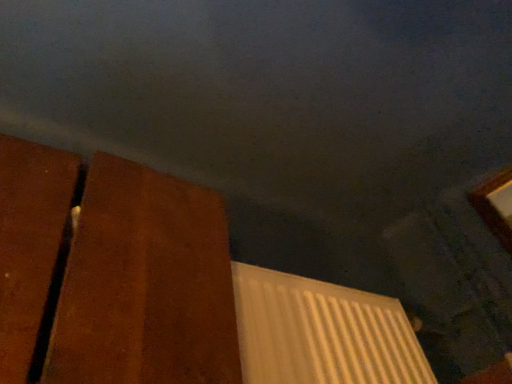
Describe the element at coordinates (145, 285) in the screenshot. This screenshot has width=512, height=384. I see `brown matte door at left` at that location.

The width and height of the screenshot is (512, 384). Identify the location of brown matte door at left. [x=145, y=285].

What are the coordinates of `brown matte door at left` in the screenshot? It's located at (145, 285).